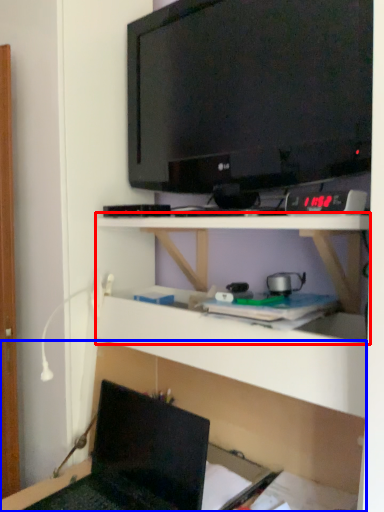
Question: Which point is further to the camera, shelf (highlighted by a red box) or shelf (highlighted by a blue box)?

Choices:
 (A) shelf
 (B) shelf

Answer: (A)